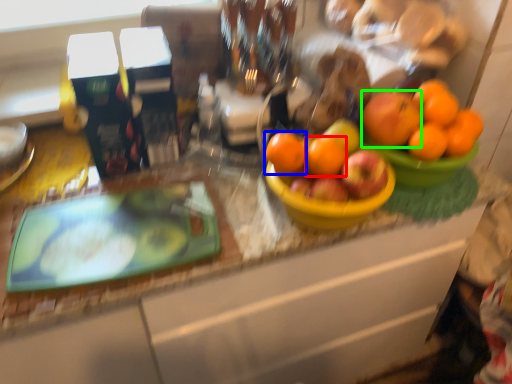
Question: Which object is positioned farthest from orange (highlighted by a red box)? Select from orange (highlighted by a blue box) and orange (highlighted by a green box).

Choices:
 (A) orange
 (B) orange

Answer: (B)